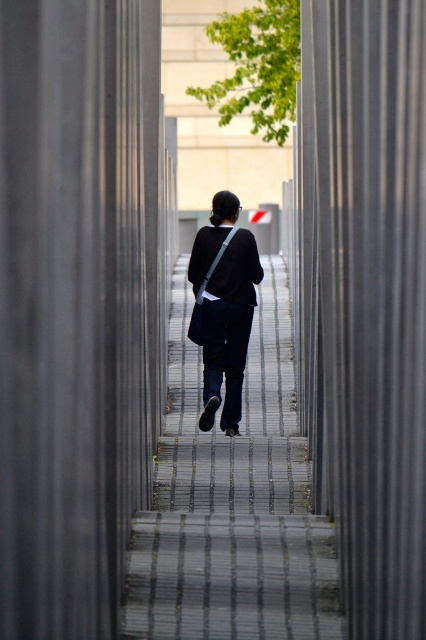
Question: Is dark blue jeans at center to the left of matte black jacket at center from the viewer's perspective?

Choices:
 (A) yes
 (B) no

Answer: (B)

Question: Can you confirm if dark blue jeans at center is wider than matte black jacket at center?

Choices:
 (A) no
 (B) yes

Answer: (B)

Question: Does dark blue jeans at center have a smaller size compared to matte black jacket at center?

Choices:
 (A) yes
 (B) no

Answer: (B)

Question: Which object is farther from the camera taking this photo?

Choices:
 (A) matte black jacket at center
 (B) dark blue jeans at center

Answer: (A)

Question: Which point is farther from the camera taking this photo?

Choices:
 (A) (236, 330)
 (B) (279, 563)

Answer: (A)